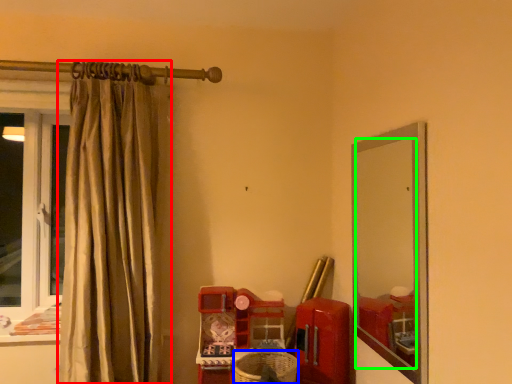
Question: Which is nearer to the curtain (highlighted by a red box)? basket (highlighted by a blue box) or mirror (highlighted by a green box).

Choices:
 (A) basket
 (B) mirror

Answer: (A)